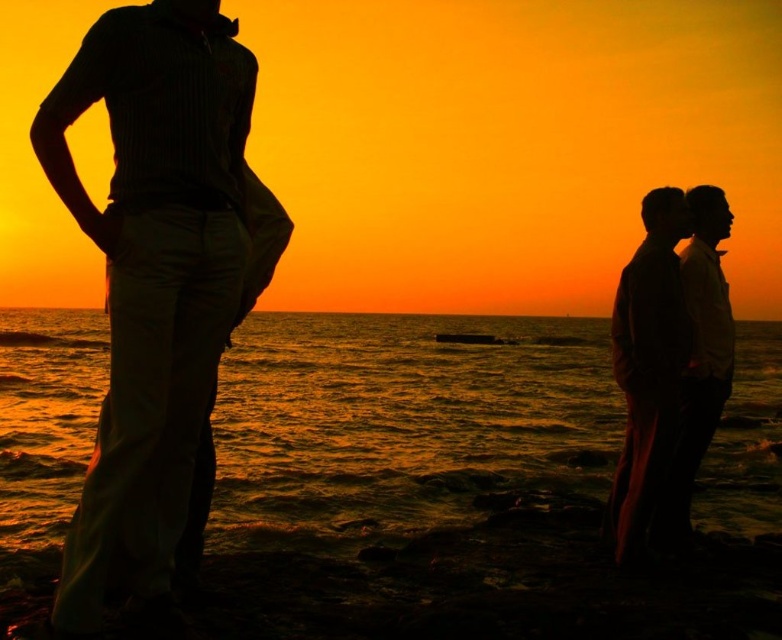
Question: Estimate the real-world distances between objects in this image. Which object is farther from the shiny metallic water at center?

Choices:
 (A) silhouette shirt at right
 (B) silhouette pants at left
 (C) silhouette couple at right

Answer: (B)

Question: Is shiny metallic water at center to the right of silhouette shirt at right from the viewer's perspective?

Choices:
 (A) yes
 (B) no

Answer: (B)

Question: Does shiny metallic water at center appear on the right side of silhouette couple at right?

Choices:
 (A) no
 (B) yes

Answer: (A)

Question: Considering the relative positions of silhouette pants at left and silhouette shirt at right in the image provided, where is silhouette pants at left located with respect to silhouette shirt at right?

Choices:
 (A) right
 (B) left

Answer: (B)

Question: Among these points, which one is nearest to the camera?

Choices:
 (A) (113, 545)
 (B) (653, 276)

Answer: (A)

Question: Which object is farther from the camera taking this photo?

Choices:
 (A) silhouette shirt at right
 (B) silhouette pants at left
 (C) silhouette couple at right

Answer: (A)